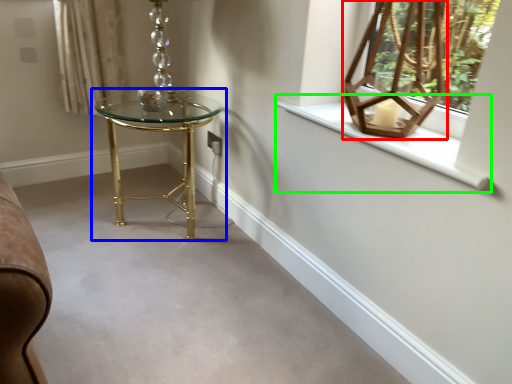
Question: Estimate the real-world distances between objects in this image. Which object is farther from table lamp (highlighted by a red box), table (highlighted by a blue box) or window sill (highlighted by a green box)?

Choices:
 (A) table
 (B) window sill

Answer: (A)